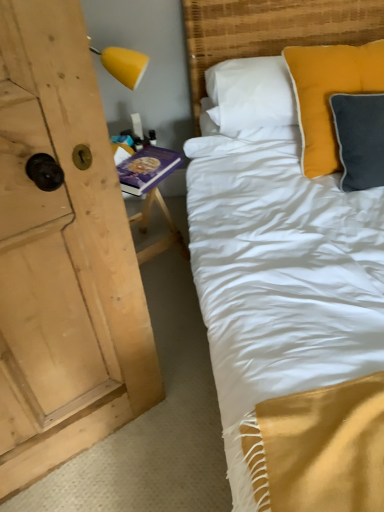
You are a GUI agent. You are given a task and a screenshot of the screen. Output one action in this format:
    pyautogui.click(x=<x>, y=<y>)
    Task: Click on the woven bamboo headboard at upper right
    The width and height of the screenshot is (384, 512).
    Given the screenshot: What is the action you would take?
    pyautogui.click(x=270, y=30)

Measure the distance between purple hardcover book at left and camera.

The depth of purple hardcover book at left is 1.33 meters.

In order to face purple hardcover book at left, should I rotate leftwards or rightwards?

Turn left by 5.300 degrees to look at purple hardcover book at left.

You are a GUI agent. You are given a task and a screenshot of the screen. Output one action in this format:
    pyautogui.click(x=<x>, y=<y>)
    Task: Click on the woven bamboo headboard at upper right
    
    Given the screenshot: What is the action you would take?
    pyautogui.click(x=270, y=30)

From the image's perspective, is woven bamboo headboard at upper right above or below purple hardcover book at left?

Clearly, from the image's perspective, woven bamboo headboard at upper right is above purple hardcover book at left.

Based on their sizes in the image, would you say woven bamboo headboard at upper right is bigger or smaller than purple hardcover book at left?

Considering their sizes, woven bamboo headboard at upper right takes up more space than purple hardcover book at left.

Is woven bamboo headboard at upper right oriented towards purple hardcover book at left?

No.

Can you tell me how much woven bamboo headboard at upper right and purple hardcover book at left differ in facing direction?

The facing directions of woven bamboo headboard at upper right and purple hardcover book at left are 10.2 degrees apart.

Is purple hardcover book at left oriented away from woven bamboo headboard at upper right?

No, purple hardcover book at left is not facing the opposite direction of woven bamboo headboard at upper right.

Considering the relative sizes of purple hardcover book at left and woven bamboo headboard at upper right in the image provided, is purple hardcover book at left shorter than woven bamboo headboard at upper right?

Correct, purple hardcover book at left is not as tall as woven bamboo headboard at upper right.

Between point (129, 177) and point (245, 26), which one is positioned in front?

The point (129, 177) is more forward.

What's the angular difference between purple hardcover book at left and woven bamboo headboard at upper right's facing directions?

purple hardcover book at left and woven bamboo headboard at upper right are facing 10.2 degrees away from each other.

Is matte yellow pillow at upper right facing away from purple hardcover book at left?

No.

In the scene shown: Can you confirm if matte yellow pillow at upper right is wider than purple hardcover book at left?

In fact, matte yellow pillow at upper right might be narrower than purple hardcover book at left.

Which object is closer to the camera taking this photo, matte yellow pillow at upper right or purple hardcover book at left?

matte yellow pillow at upper right is more forward.

Is matte yellow pillow at upper right directly adjacent to purple hardcover book at left?

There is a gap between matte yellow pillow at upper right and purple hardcover book at left.

Is woven bamboo headboard at upper right located within matte yellow pillow at upper right?

No, woven bamboo headboard at upper right is not surrounded by matte yellow pillow at upper right.

Does point (358, 51) appear closer or farther from the camera than point (335, 19)?

Point (358, 51).

Who is more distant, matte yellow pillow at upper right or woven bamboo headboard at upper right?

woven bamboo headboard at upper right is further from the camera.

Does matte yellow pillow at upper right have a smaller size compared to woven bamboo headboard at upper right?

Yes.

Who is taller, woven bamboo headboard at upper right or matte yellow pillow at upper right?

woven bamboo headboard at upper right is taller.

Which point is more forward, (251, 4) or (309, 114)?

The point (309, 114) is in front.

Is woven bamboo headboard at upper right not within matte yellow pillow at upper right?

Absolutely, woven bamboo headboard at upper right is external to matte yellow pillow at upper right.

Is woven bamboo headboard at upper right facing away from matte yellow pillow at upper right?

No, woven bamboo headboard at upper right's orientation is not away from matte yellow pillow at upper right.

Consider the image. Considering the relative sizes of purple hardcover book at left and matte yellow pillow at upper right in the image provided, is purple hardcover book at left bigger than matte yellow pillow at upper right?

Yes, purple hardcover book at left is bigger than matte yellow pillow at upper right.

Is purple hardcover book at left in contact with matte yellow pillow at upper right?

purple hardcover book at left and matte yellow pillow at upper right are not in contact.

Does purple hardcover book at left lie in front of matte yellow pillow at upper right?

No, the depth of purple hardcover book at left is greater than that of matte yellow pillow at upper right.

Which object is positioned more to the right, purple hardcover book at left or matte yellow pillow at upper right?

matte yellow pillow at upper right is more to the right.

In the image, there is a woven bamboo headboard at upper right. At what (x,y) coordinates should I click in order to perform the action: click on table below it (from a real-world perspective). Please return your answer as a coordinate pair (x, y). The width and height of the screenshot is (384, 512). Looking at the image, I should click on (151, 193).

Find the location of a particular element. headboard above the purple hardcover book at left (from the image's perspective) is located at coordinates (270, 30).

Which object lies further to the anchor point woven bamboo headboard at upper right, matte yellow pillow at upper right or purple hardcover book at left?

The object further to woven bamboo headboard at upper right is purple hardcover book at left.

Estimate the real-world distances between objects in this image. Which object is further from woven bamboo headboard at upper right, purple hardcover book at left or matte yellow pillow at upper right?

purple hardcover book at left lies further to woven bamboo headboard at upper right than the other object.

From the picture: Which object lies further to the anchor point matte yellow pillow at upper right, purple hardcover book at left or woven bamboo headboard at upper right?

Among the two, purple hardcover book at left is located further to matte yellow pillow at upper right.

Based on their spatial positions, is matte yellow pillow at upper right or woven bamboo headboard at upper right closer to purple hardcover book at left?

matte yellow pillow at upper right lies closer to purple hardcover book at left than the other object.

When comparing their distances from purple hardcover book at left, does woven bamboo headboard at upper right or matte yellow pillow at upper right seem further?

Based on the image, woven bamboo headboard at upper right appears to be further to purple hardcover book at left.

Considering their positions, is woven bamboo headboard at upper right positioned closer to matte yellow pillow at upper right than purple hardcover book at left?

The object closer to matte yellow pillow at upper right is woven bamboo headboard at upper right.

I want to click on headboard between purple hardcover book at left and matte yellow pillow at upper right from left to right, so click(x=270, y=30).